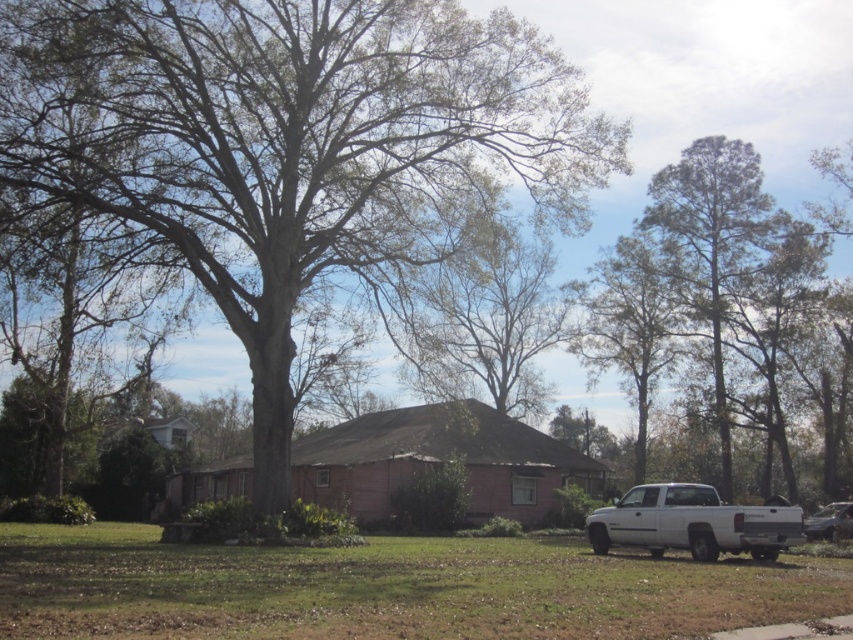
You are a delivery person trying to park your van, which is 2 meters wide, in the driveway next to the house. There is space between the white matte truck at lower right and the metallic silver sedan at lower right. Can your van fit between them?

The white matte truck at lower right might be wider than metallic silver sedan at lower right, so the space between them is uncertain. It is possible that the space is narrower than 2 meters, so the van may not fit. Check the actual distance before attempting to park.

You are a gardener who needs to mow the green grass at lower right. The bare wood tree at center has low branches. Will the branches interfere with your lawnmower?

The bare wood tree at center is taller than green grass at lower right, so the branches may still be higher than the lawnmower, but since the tree is taller, there might be lower branches that could interfere. Check the branch height before mowing.